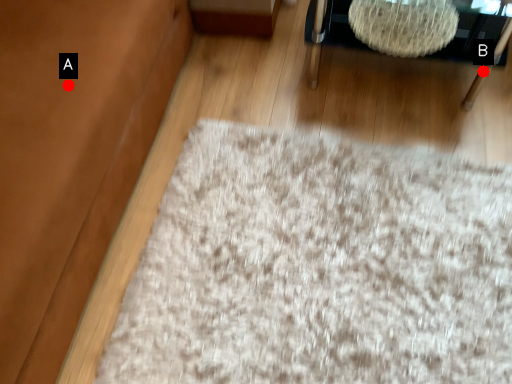
Question: Two points are circled on the image, labeled by A and B beside each circle. Which point is farther to the camera?

Choices:
 (A) A is further
 (B) B is further

Answer: (B)